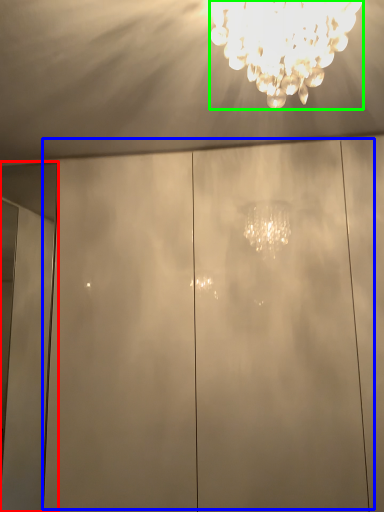
Question: Which object is positioned closest to door (highlighted by a red box)? Select from glass door (highlighted by a blue box) and lamp (highlighted by a green box).

Choices:
 (A) glass door
 (B) lamp

Answer: (A)